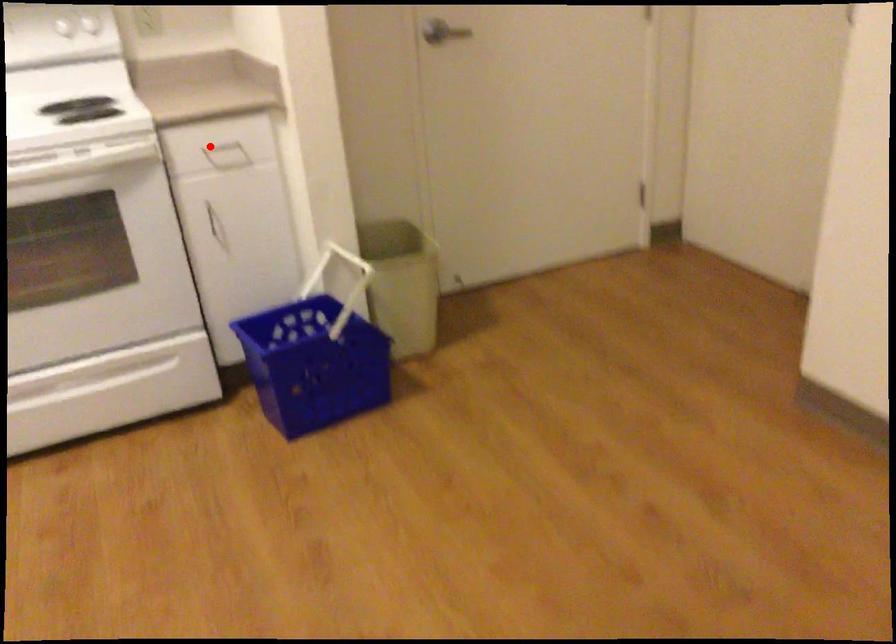
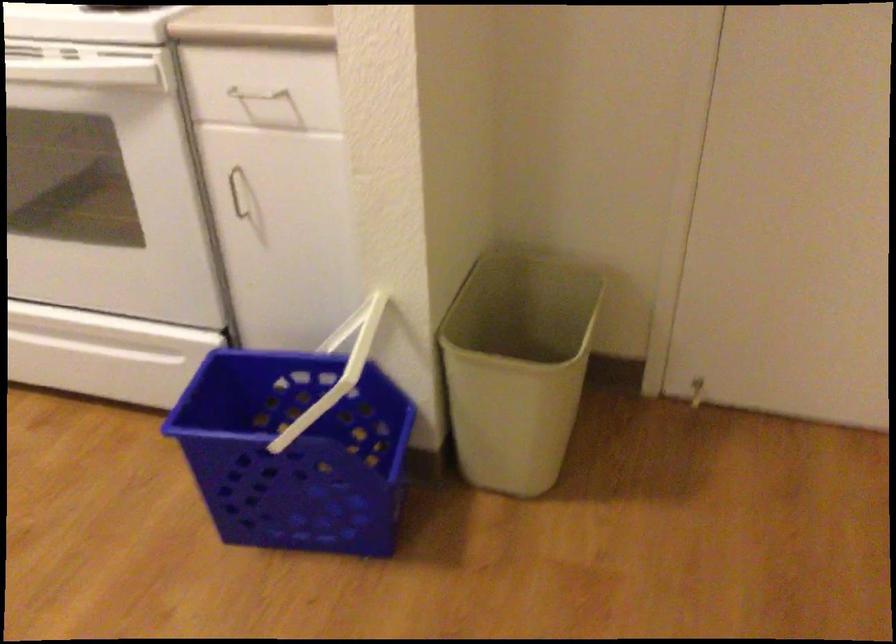
Question: I am providing you with two images of the same scene from different viewpoints. Given a red point in image1, look at the same physical point in image2. Is it:

Choices:
 (A) Closer to the viewpoint
 (B) Farther from the viewpoint

Answer: (A)